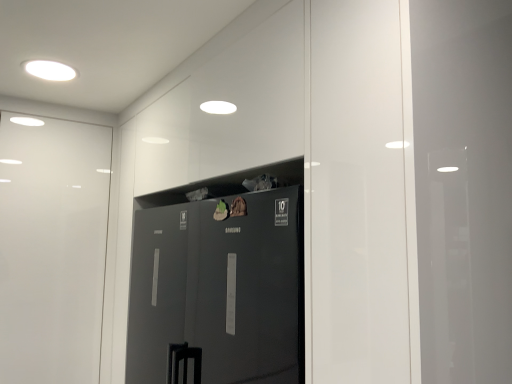
Question: From a real-world perspective, is glossy black refrigerator at center on white glossy light fixture at upper left?

Choices:
 (A) no
 (B) yes

Answer: (A)

Question: From the image's perspective, does glossy black refrigerator at center appear lower than white glossy light fixture at upper left?

Choices:
 (A) no
 (B) yes

Answer: (B)

Question: Considering the relative positions of glossy black refrigerator at center and white glossy light fixture at upper left in the image provided, is glossy black refrigerator at center to the left of white glossy light fixture at upper left from the viewer's perspective?

Choices:
 (A) yes
 (B) no

Answer: (B)

Question: Does glossy black refrigerator at center have a greater width compared to white glossy light fixture at upper left?

Choices:
 (A) no
 (B) yes

Answer: (B)

Question: Are glossy black refrigerator at center and white glossy light fixture at upper left making contact?

Choices:
 (A) no
 (B) yes

Answer: (A)

Question: Could you tell me if glossy black refrigerator at center is facing white glossy light fixture at upper left?

Choices:
 (A) no
 (B) yes

Answer: (A)

Question: Does white glossy light fixture at upper left contain glossy black refrigerator at center?

Choices:
 (A) no
 (B) yes

Answer: (A)

Question: Does white glossy light fixture at upper left turn towards glossy black refrigerator at center?

Choices:
 (A) no
 (B) yes

Answer: (A)

Question: Is white glossy light fixture at upper left thinner than glossy black refrigerator at center?

Choices:
 (A) yes
 (B) no

Answer: (A)

Question: Is white glossy light fixture at upper left not inside glossy black refrigerator at center?

Choices:
 (A) yes
 (B) no

Answer: (A)

Question: Considering the relative sizes of white glossy light fixture at upper left and glossy black refrigerator at center in the image provided, is white glossy light fixture at upper left taller than glossy black refrigerator at center?

Choices:
 (A) yes
 (B) no

Answer: (B)

Question: Is white glossy light fixture at upper left wider than glossy black refrigerator at center?

Choices:
 (A) yes
 (B) no

Answer: (B)

Question: Considering their positions, is glossy black refrigerator at center located in front of or behind white glossy light fixture at upper left?

Choices:
 (A) behind
 (B) front

Answer: (B)